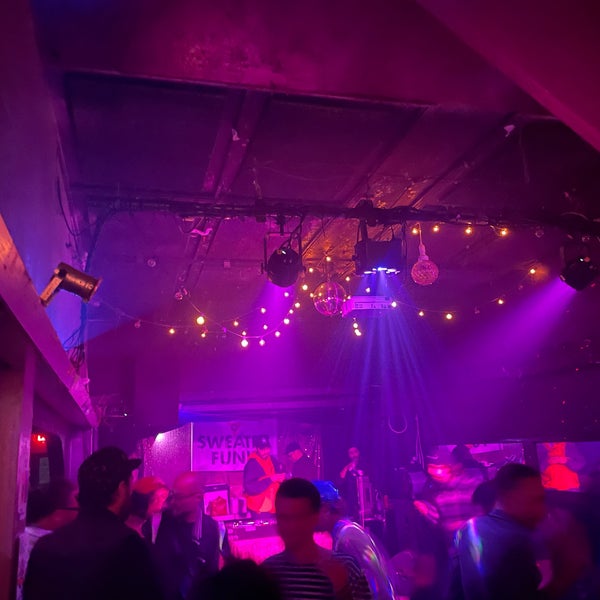
Find the location of a particular element. This screenshot has height=600, width=600. walls is located at coordinates (270, 364), (551, 400), (67, 247).